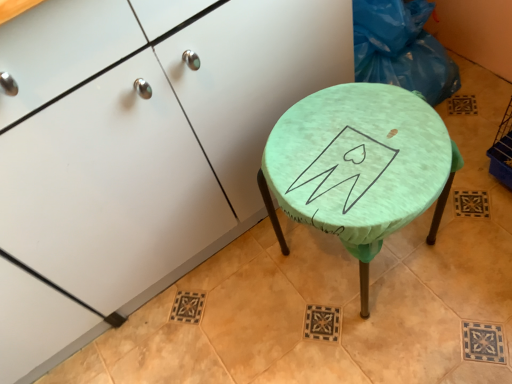
The width and height of the screenshot is (512, 384). I want to click on blank space to the left of green fabric-covered stool at center, so click(x=259, y=301).